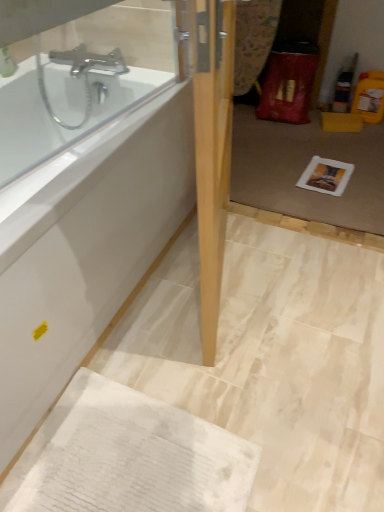
Question: Is white glossy bathtub at upper left placed right next to transparent glass door at center?

Choices:
 (A) yes
 (B) no

Answer: (B)

Question: Is transparent glass door at center inside white glossy bathtub at upper left?

Choices:
 (A) no
 (B) yes

Answer: (A)

Question: Is white glossy bathtub at upper left shorter than transparent glass door at center?

Choices:
 (A) no
 (B) yes

Answer: (B)

Question: From a real-world perspective, is white glossy bathtub at upper left positioned under transparent glass door at center based on gravity?

Choices:
 (A) no
 (B) yes

Answer: (B)

Question: Can you confirm if white glossy bathtub at upper left is positioned to the left of transparent glass door at center?

Choices:
 (A) no
 (B) yes

Answer: (B)

Question: Relative to white paper at center, is light wood door at center in front or behind?

Choices:
 (A) behind
 (B) front

Answer: (B)

Question: Looking at their shapes, would you say light wood door at center is wider or thinner than white paper at center?

Choices:
 (A) thin
 (B) wide

Answer: (A)

Question: From the image's perspective, relative to white paper at center, is light wood door at center above or below?

Choices:
 (A) above
 (B) below

Answer: (B)

Question: Is light wood door at center to the left or to the right of white paper at center in the image?

Choices:
 (A) left
 (B) right

Answer: (A)

Question: Considering the positions of transparent glass door at center and white glossy bathtub at upper left in the image, is transparent glass door at center bigger or smaller than white glossy bathtub at upper left?

Choices:
 (A) big
 (B) small

Answer: (B)

Question: Considering the positions of point (238, 164) and point (6, 450), is point (238, 164) closer or farther from the camera than point (6, 450)?

Choices:
 (A) farther
 (B) closer

Answer: (A)

Question: From a real-world perspective, is transparent glass door at center positioned above or below white glossy bathtub at upper left?

Choices:
 (A) below
 (B) above

Answer: (B)

Question: From their relative heights in the image, would you say transparent glass door at center is taller or shorter than white glossy bathtub at upper left?

Choices:
 (A) tall
 (B) short

Answer: (A)

Question: From a real-world perspective, is white glossy bathtub at upper left above or below white textured towel at lower left?

Choices:
 (A) above
 (B) below

Answer: (A)

Question: In the image, is white glossy bathtub at upper left positioned in front of or behind white textured towel at lower left?

Choices:
 (A) front
 (B) behind

Answer: (A)